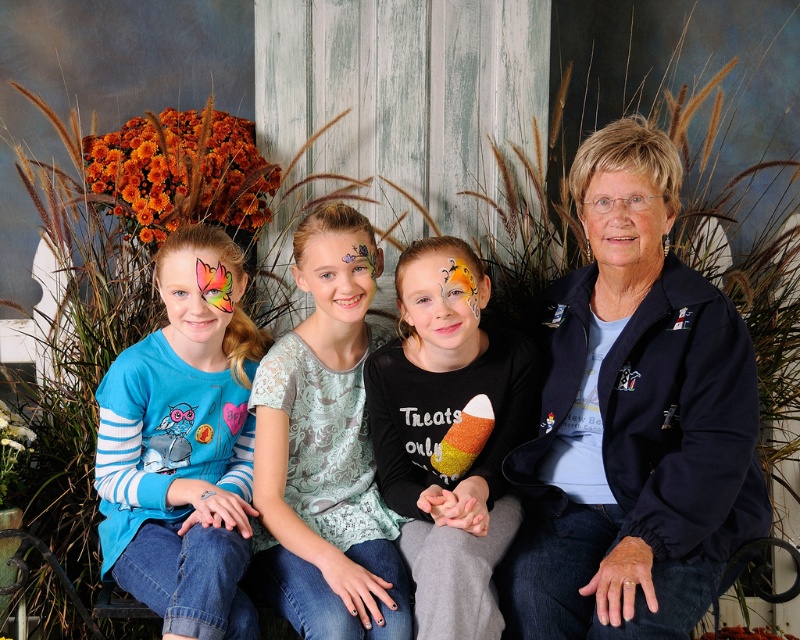
Can you confirm if navy blue jacket at right is positioned below matte blue shirt at left?

Actually, navy blue jacket at right is above matte blue shirt at left.

Is navy blue jacket at right to the left of matte blue shirt at left from the viewer's perspective?

Incorrect, navy blue jacket at right is not on the left side of matte blue shirt at left.

Which is behind, point (544, 548) or point (108, 461)?

Point (108, 461)

Find the location of a particular element. The height and width of the screenshot is (640, 800). navy blue jacket at right is located at coordinates (632, 420).

Is point (344, 282) less distant than point (484, 440)?

Yes, it is in front of point (484, 440).

Is point (318, 275) positioned after point (446, 438)?

That is False.

The image size is (800, 640). Identify the location of matte skin face at center. (337, 280).

Who is more forward, (586, 164) or (625, 241)?

Point (625, 241) is in front.

Where is `navy blue jacket at right`? The height and width of the screenshot is (640, 800). navy blue jacket at right is located at coordinates (632, 420).

This screenshot has height=640, width=800. Identify the location of navy blue jacket at right. [632, 420].